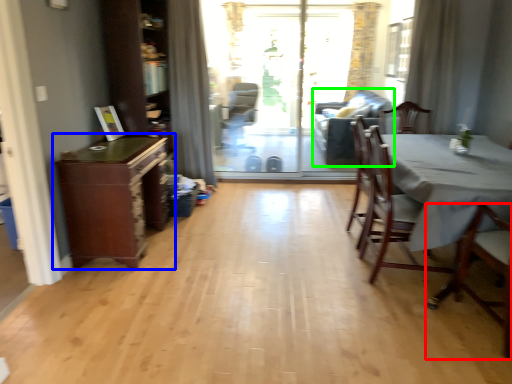
Question: Considering the real-world distances, which object is closest to chair (highlighted by a red box)? cabinetry (highlighted by a blue box) or couch (highlighted by a green box).

Choices:
 (A) cabinetry
 (B) couch

Answer: (A)